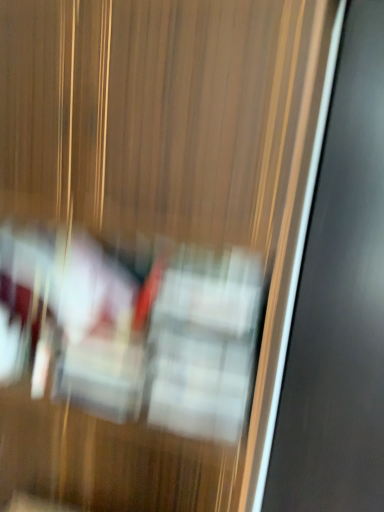
What is the approximate height of black matte screen door at right?

It is 6.31 feet.

You are a GUI agent. You are given a task and a screenshot of the screen. Output one action in this format:
    pyautogui.click(x=<x>, y=<y>)
    Task: Click on the black matte screen door at right
    Image resolution: width=384 pixels, height=512 pixels.
    Given the screenshot: What is the action you would take?
    pyautogui.click(x=339, y=301)

Measure the distance between point (335, 100) and camera.

A distance of 3.89 feet exists between point (335, 100) and camera.

Image resolution: width=384 pixels, height=512 pixels. What do you see at coordinates (339, 301) in the screenshot? I see `black matte screen door at right` at bounding box center [339, 301].

This screenshot has width=384, height=512. I want to click on black matte screen door at right, so click(339, 301).